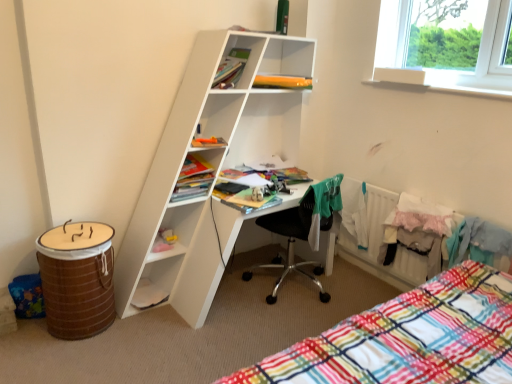
Find the location of `vacant space that's between white matte book at lower left, which appears as the 1th book when ordered from the bottom, and brown woven barrel at lower left`. vacant space that's between white matte book at lower left, which appears as the 1th book when ordered from the bottom, and brown woven barrel at lower left is located at coordinates (148, 313).